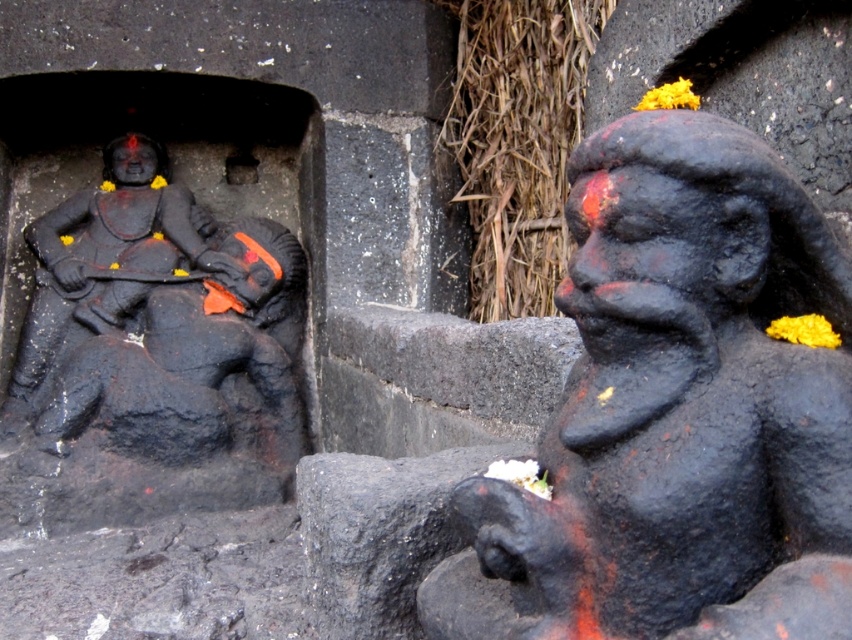
Question: Does black stone monkey at right appear under matte black statue at left?

Choices:
 (A) yes
 (B) no

Answer: (A)

Question: Can you confirm if black stone monkey at right is thinner than matte black statue at left?

Choices:
 (A) yes
 (B) no

Answer: (A)

Question: From the image, what is the correct spatial relationship of black stone monkey at right in relation to matte black statue at left?

Choices:
 (A) right
 (B) left

Answer: (A)

Question: Which object is farther from the camera taking this photo?

Choices:
 (A) matte black statue at left
 (B) black stone monkey at right

Answer: (A)

Question: Which of the following is the closest to the observer?

Choices:
 (A) (441, 621)
 (B) (26, 388)

Answer: (A)